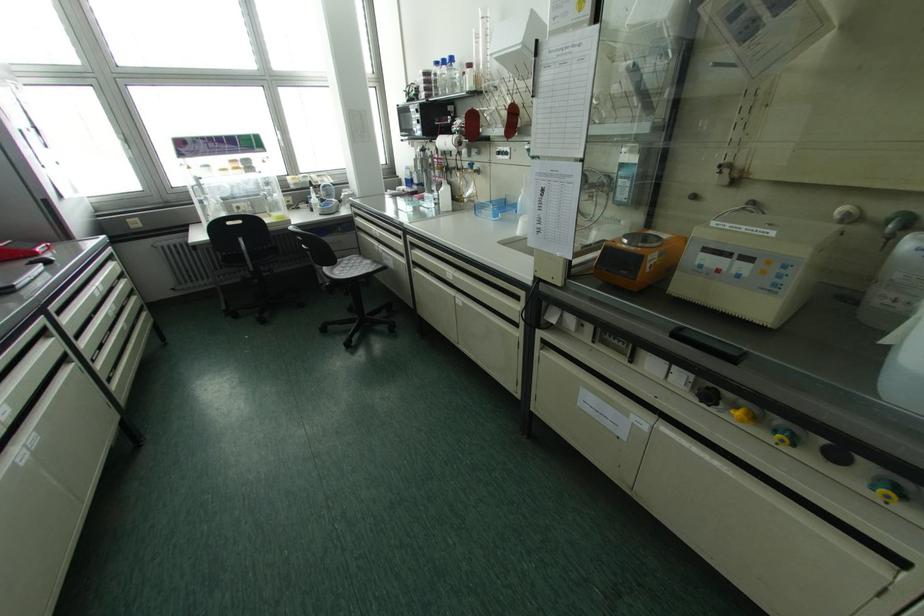
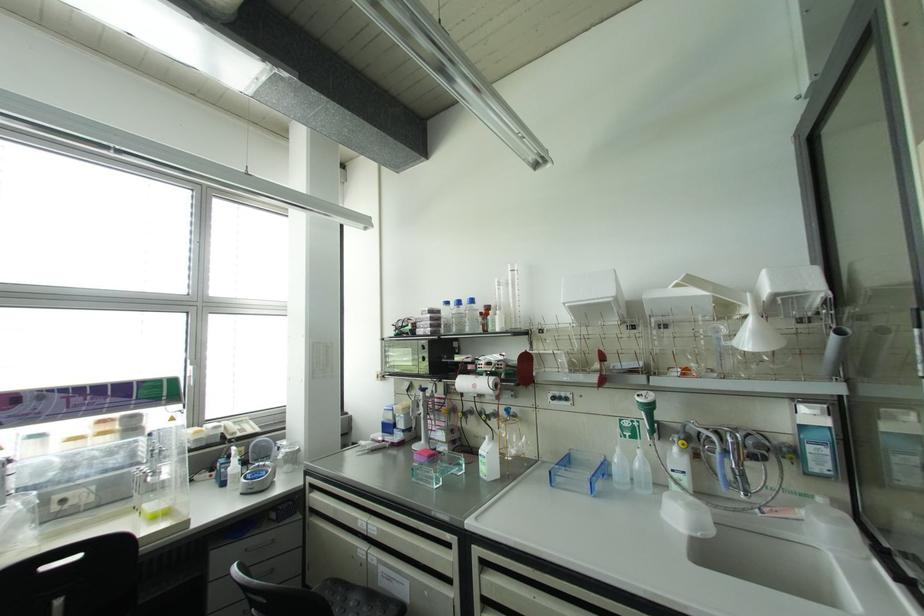
The point at (435,63) is marked in the first image. Where is the corresponding point in the second image?

(446, 302)